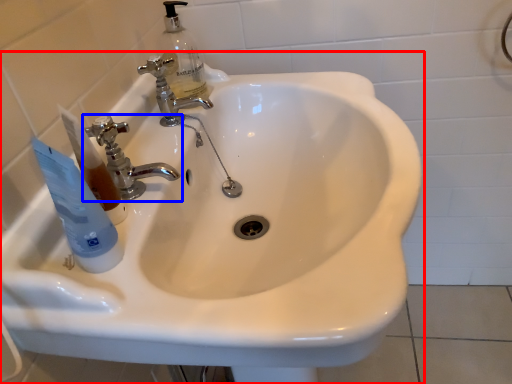
Question: Which object is closer to the camera taking this photo, sink (highlighted by a red box) or tap (highlighted by a blue box)?

Choices:
 (A) sink
 (B) tap

Answer: (A)